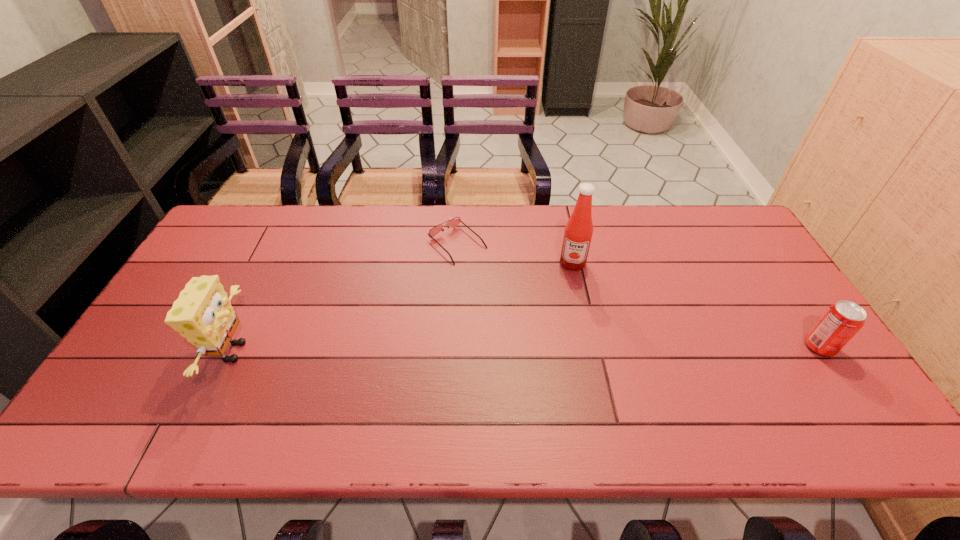
The image size is (960, 540). Identify the location of free space between the leftmost object and the sunglasses. (346, 298).

You are a GUI agent. You are given a task and a screenshot of the screen. Output one action in this format:
    pyautogui.click(x=<x>, y=<y>)
    Task: Click on the empty space that is in between the second object from left to right and the rightmost object
    This screenshot has width=960, height=540.
    Given the screenshot: What is the action you would take?
    pyautogui.click(x=638, y=295)

At what (x,y) coordinates should I click in order to perform the action: click on free space between the third shortest object and the third tallest object. Please return your answer as a coordinate pair (x, y). The width and height of the screenshot is (960, 540). Looking at the image, I should click on (526, 349).

Identify the location of free space between the shortest object and the tallest object. This screenshot has height=540, width=960. (515, 254).

Locate an element on the screen. The width and height of the screenshot is (960, 540). object that ranks as the second closest to the shortest object is located at coordinates (202, 314).

I want to click on object that is the third closest to the condiment, so click(202, 314).